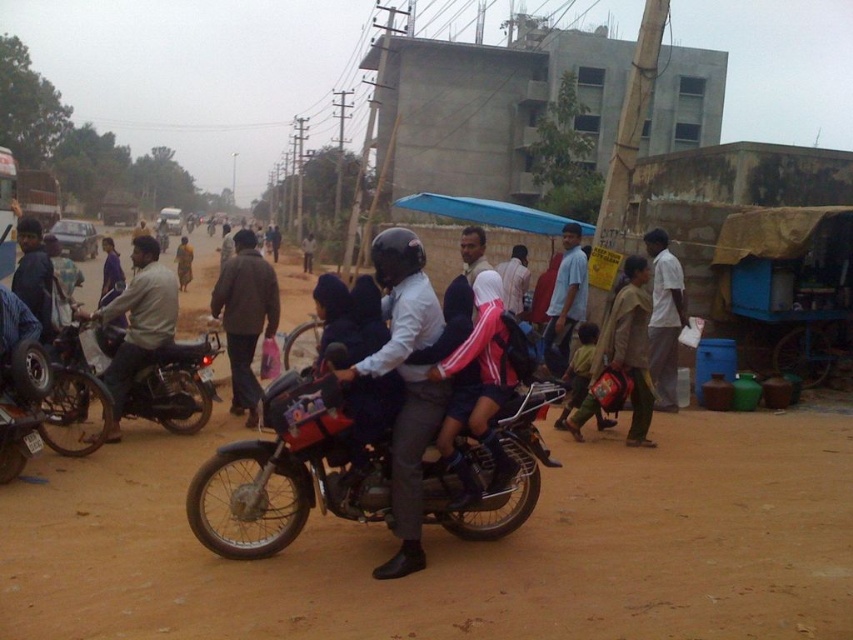
You are a pedestrian standing on the dirt road and see both the red matte motorcycle at center and the brushed metal motorcycle at center. Which motorcycle is closer to you?

The red matte motorcycle at center is closer to you because it is in front of the brushed metal motorcycle at center.

You are standing on the dirt road and want to move from point (x=349, y=445) to point (x=15, y=380). Which direction should you face to walk towards the second point?

You should face downward because point (x=349, y=445) is closer to the viewer than point (x=15, y=380), so the second point is located further away in the lower direction from your current position.